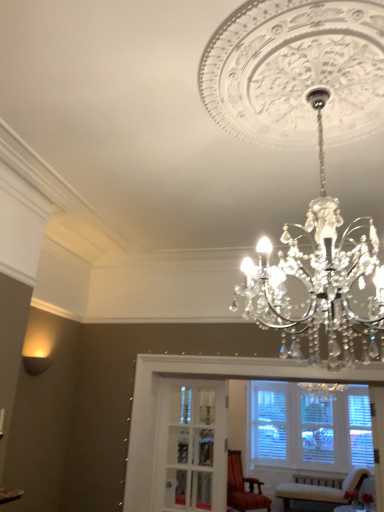
Question: From the image's perspective, is matte black wall sconce at lower left beneath wooden armchair at center, arranged as the 2th chair when viewed from the right?

Choices:
 (A) no
 (B) yes

Answer: (A)

Question: Is wooden armchair at center, arranged as the 2th chair when viewed from the right, a part of matte black wall sconce at lower left?

Choices:
 (A) no
 (B) yes

Answer: (A)

Question: Is matte black wall sconce at lower left at the right side of wooden armchair at center, arranged as the 2th chair when viewed from the right?

Choices:
 (A) yes
 (B) no

Answer: (B)

Question: Is matte black wall sconce at lower left outside of wooden armchair at center, arranged as the 2th chair when viewed from the right?

Choices:
 (A) yes
 (B) no

Answer: (A)

Question: Does matte black wall sconce at lower left have a lesser height compared to wooden armchair at center, arranged as the 2th chair when viewed from the right?

Choices:
 (A) no
 (B) yes

Answer: (B)

Question: In terms of height, does wooden armchair at center, arranged as the 2th chair when viewed from the right, look taller or shorter compared to matte black wall sconce at lower left?

Choices:
 (A) tall
 (B) short

Answer: (A)

Question: Is wooden armchair at center, arranged as the 2th chair when viewed from the right, inside the boundaries of matte black wall sconce at lower left, or outside?

Choices:
 (A) outside
 (B) inside

Answer: (A)

Question: In the image, is wooden armchair at center, placed as the first chair when sorted from left to right, on the left side or the right side of matte black wall sconce at lower left?

Choices:
 (A) right
 (B) left

Answer: (A)

Question: From the image's perspective, is wooden armchair at center, placed as the first chair when sorted from left to right, positioned above or below matte black wall sconce at lower left?

Choices:
 (A) below
 (B) above

Answer: (A)

Question: Is point (364, 474) positioned closer to the camera than point (39, 372)?

Choices:
 (A) closer
 (B) farther

Answer: (A)

Question: From a real-world perspective, is velvet beige chair at lower right, the 2th chair when ordered from left to right, positioned above or below matte black wall sconce at lower left?

Choices:
 (A) above
 (B) below

Answer: (B)

Question: From the image's perspective, relative to matte black wall sconce at lower left, is velvet beige chair at lower right, the 1th chair from the right, above or below?

Choices:
 (A) above
 (B) below

Answer: (B)

Question: Considering the relative positions of velvet beige chair at lower right, the 2th chair when ordered from left to right, and matte black wall sconce at lower left in the image provided, is velvet beige chair at lower right, the 2th chair when ordered from left to right, to the left or to the right of matte black wall sconce at lower left?

Choices:
 (A) left
 (B) right

Answer: (B)

Question: From a real-world perspective, relative to velvet beige chair at lower right, the 2th chair when ordered from left to right, is matte black wall sconce at lower left vertically above or below?

Choices:
 (A) above
 (B) below

Answer: (A)

Question: Does point (41, 367) appear closer or farther from the camera than point (360, 477)?

Choices:
 (A) farther
 (B) closer

Answer: (A)